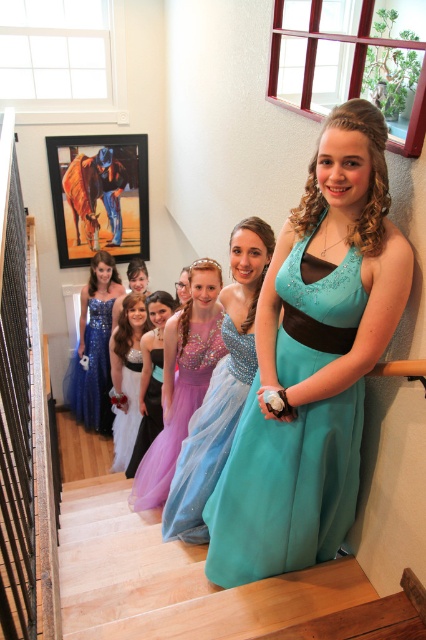
Is point (198, 476) farther from viewer compared to point (89, 312)?

No, it is not.

This screenshot has width=426, height=640. What do you see at coordinates (221, 387) in the screenshot? I see `sparkly teal dress at center` at bounding box center [221, 387].

Between point (239, 410) and point (68, 384), which one is positioned behind?

The point (68, 384) is more distant.

This screenshot has height=640, width=426. In order to click on sparkly teal dress at center in this screenshot , I will do `click(221, 387)`.

Can you confirm if purple tulle dress at center is thinner than shiny blue dress at left?

Yes, purple tulle dress at center is thinner than shiny blue dress at left.

Does purple tulle dress at center have a greater height compared to shiny blue dress at left?

Incorrect, purple tulle dress at center's height is not larger of shiny blue dress at left's.

Which is behind, point (141, 476) or point (100, 349)?

Positioned behind is point (100, 349).

I want to click on purple tulle dress at center, so click(x=178, y=410).

Which is behind, point (100, 348) or point (146, 294)?

The point (100, 348) is more distant.

Where is `shiny blue dress at left`? The height and width of the screenshot is (640, 426). shiny blue dress at left is located at coordinates (92, 371).